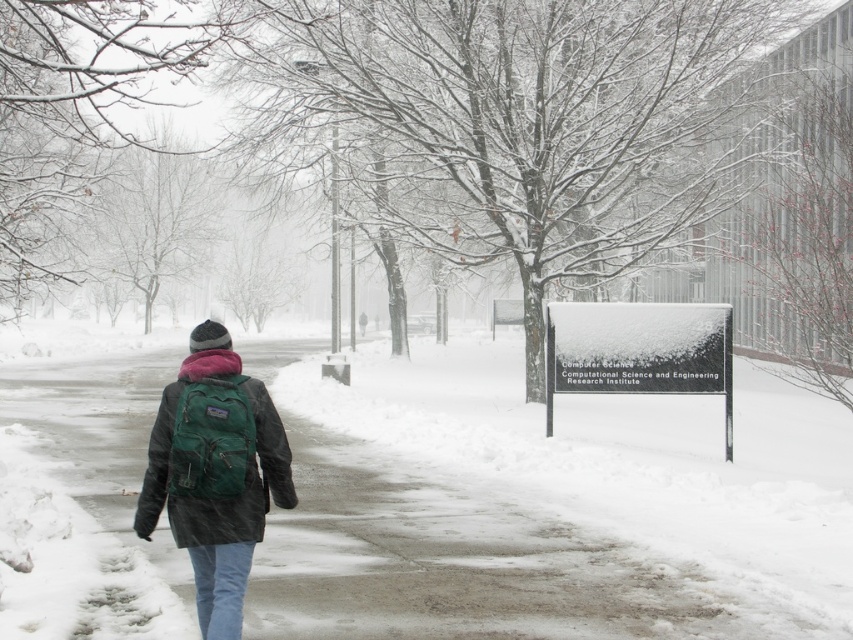
Between slick asphalt pavement at center and matte green backpack at center-left, which one is positioned lower?

slick asphalt pavement at center

Can you confirm if slick asphalt pavement at center is taller than matte green backpack at center-left?

No, slick asphalt pavement at center is not taller than matte green backpack at center-left.

Locate an element on the screen. Image resolution: width=853 pixels, height=640 pixels. slick asphalt pavement at center is located at coordinates (508, 545).

Locate an element on the screen. This screenshot has width=853, height=640. slick asphalt pavement at center is located at coordinates (508, 545).